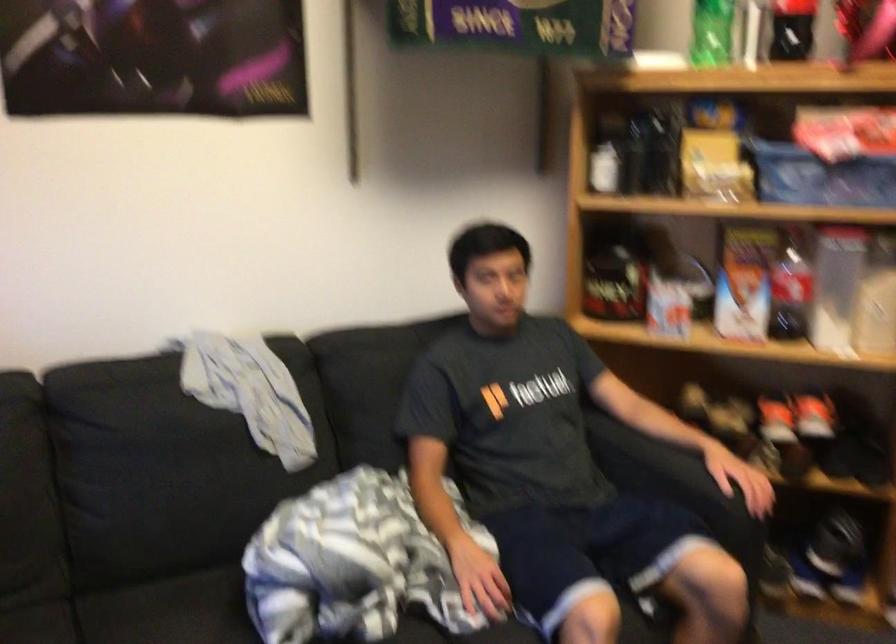
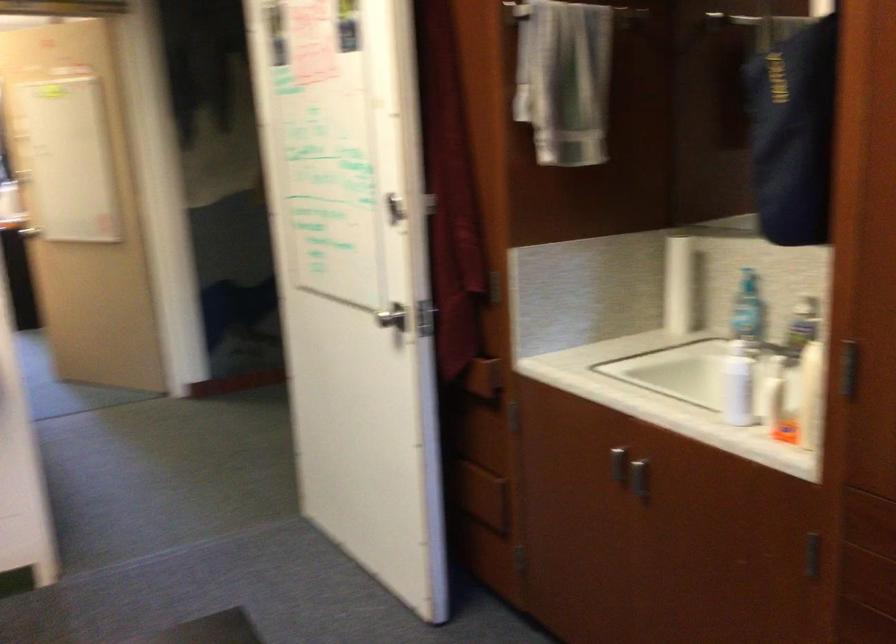
Question: The first image is from the beginning of the video and the second image is from the end. How did the camera likely rotate when shooting the video?

Choices:
 (A) Left
 (B) Right
 (C) Up
 (D) Down

Answer: (B)